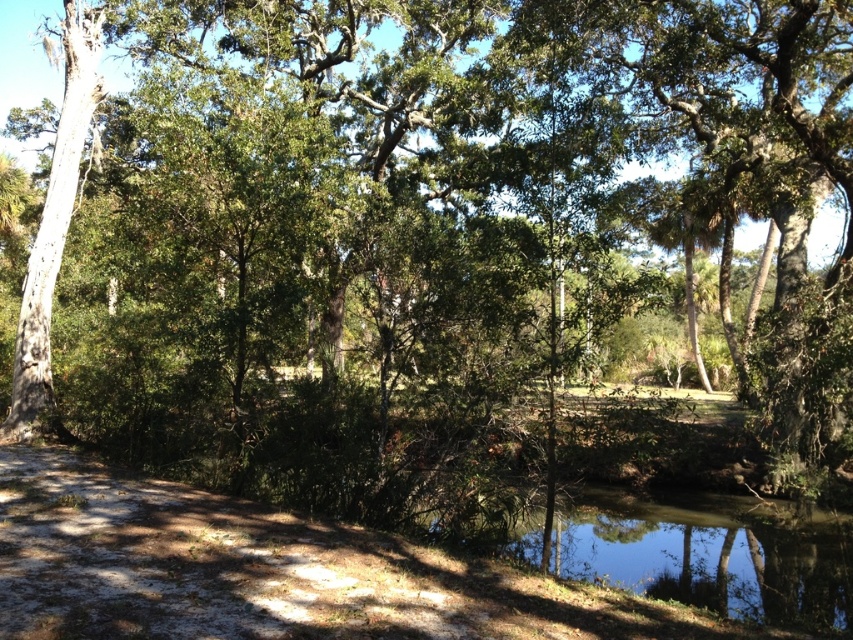
You are standing on the sandy or dirt path in the foreground of the serene natural scene. You see a point marked at coordinates point [711,554]. Based on the description, is this point located on the water or on the path?

The point [711,554] is on clear water at lower center, so it is located on the water.

You are standing on the sandy path and want to cross to the other side of the clear water at lower center. The smooth white tree trunk at left is nearby. Can you use the tree trunk to help you cross the water?

The clear water at lower center has a lesser height compared to the smooth white tree trunk at left, so the tree trunk is taller. However, the tree trunk is not a bridge, so it cannot be used to cross the water.

You are planning to take a photo of the clear water at lower center and the smooth white tree trunk at left. Which object should you focus on first if you want to capture both in a single frame without moving the camera?

You should focus on the clear water at lower center first because it has a larger size compared to the smooth white tree trunk at left, making it the primary subject for the composition.